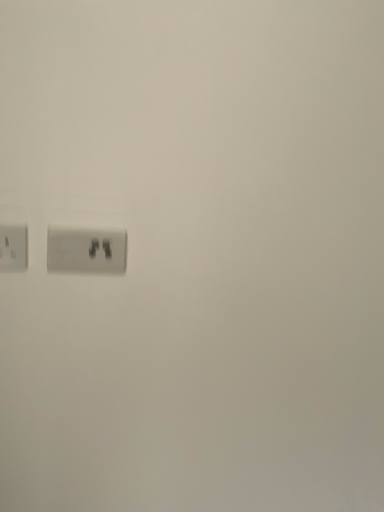
What do you see at coordinates (86, 251) in the screenshot? The image size is (384, 512). I see `white plastic power plugs and sockets at center, marked as the first power plugs and sockets in a right-to-left arrangement` at bounding box center [86, 251].

In the scene shown: How much space does white plastic power plugs and sockets at center, the second power plugs and sockets viewed from the left, occupy vertically?

It is 3.53 inches.

Locate an element on the screen. The width and height of the screenshot is (384, 512). white plastic power plugs and sockets at center, the second power plugs and sockets viewed from the left is located at coordinates (86, 251).

I want to click on matte white power plug at left, which is the first power plugs and sockets from left to right, so click(x=13, y=248).

This screenshot has width=384, height=512. What do you see at coordinates (13, 248) in the screenshot?
I see `matte white power plug at left, which is the first power plugs and sockets from left to right` at bounding box center [13, 248].

How much space does matte white power plug at left, which is the first power plugs and sockets from left to right, occupy horizontally?

The width of matte white power plug at left, which is the first power plugs and sockets from left to right, is 1.77 centimeters.

The image size is (384, 512). In order to click on white plastic power plugs and sockets at center, the second power plugs and sockets viewed from the left in this screenshot , I will do `click(86, 251)`.

Is white plastic power plugs and sockets at center, the second power plugs and sockets viewed from the left, at the left side of matte white power plug at left, the 2th power plugs and sockets viewed from the right?

No, white plastic power plugs and sockets at center, the second power plugs and sockets viewed from the left, is not to the left of matte white power plug at left, the 2th power plugs and sockets viewed from the right.

Which object is closer to the camera taking this photo, white plastic power plugs and sockets at center, the second power plugs and sockets viewed from the left, or matte white power plug at left, which is the first power plugs and sockets from left to right?

matte white power plug at left, which is the first power plugs and sockets from left to right, is closer to the camera.

Which is closer to the camera, (x=47, y=234) or (x=25, y=252)?

The point (x=47, y=234) is more forward.

From the image's perspective, does white plastic power plugs and sockets at center, the second power plugs and sockets viewed from the left, appear higher than matte white power plug at left, the 2th power plugs and sockets viewed from the right?

No, from the image's perspective, white plastic power plugs and sockets at center, the second power plugs and sockets viewed from the left, is not over matte white power plug at left, the 2th power plugs and sockets viewed from the right.

From a real-world perspective, which object stands above the other?

matte white power plug at left, the 2th power plugs and sockets viewed from the right.

Is white plastic power plugs and sockets at center, the second power plugs and sockets viewed from the left, wider or thinner than matte white power plug at left, the 2th power plugs and sockets viewed from the right?

In the image, white plastic power plugs and sockets at center, the second power plugs and sockets viewed from the left, appears to be wider than matte white power plug at left, the 2th power plugs and sockets viewed from the right.

In terms of height, does white plastic power plugs and sockets at center, marked as the first power plugs and sockets in a right-to-left arrangement, look taller or shorter compared to matte white power plug at left, the 2th power plugs and sockets viewed from the right?

In the image, white plastic power plugs and sockets at center, marked as the first power plugs and sockets in a right-to-left arrangement, appears to be taller than matte white power plug at left, the 2th power plugs and sockets viewed from the right.

Considering the sizes of objects white plastic power plugs and sockets at center, the second power plugs and sockets viewed from the left, and matte white power plug at left, the 2th power plugs and sockets viewed from the right, in the image provided, who is bigger, white plastic power plugs and sockets at center, the second power plugs and sockets viewed from the left, or matte white power plug at left, the 2th power plugs and sockets viewed from the right,?

white plastic power plugs and sockets at center, the second power plugs and sockets viewed from the left, is bigger.

Is white plastic power plugs and sockets at center, marked as the first power plugs and sockets in a right-to-left arrangement, inside or outside of matte white power plug at left, the 2th power plugs and sockets viewed from the right?

white plastic power plugs and sockets at center, marked as the first power plugs and sockets in a right-to-left arrangement, cannot be found inside matte white power plug at left, the 2th power plugs and sockets viewed from the right.

Is white plastic power plugs and sockets at center, the second power plugs and sockets viewed from the left, far away from matte white power plug at left, which is the first power plugs and sockets from left to right?

That's not correct — white plastic power plugs and sockets at center, the second power plugs and sockets viewed from the left, is a little close to matte white power plug at left, which is the first power plugs and sockets from left to right.

Is white plastic power plugs and sockets at center, the second power plugs and sockets viewed from the left, oriented towards matte white power plug at left, the 2th power plugs and sockets viewed from the right?

No, white plastic power plugs and sockets at center, the second power plugs and sockets viewed from the left, is not aimed at matte white power plug at left, the 2th power plugs and sockets viewed from the right.

What's the angular difference between white plastic power plugs and sockets at center, the second power plugs and sockets viewed from the left, and matte white power plug at left, the 2th power plugs and sockets viewed from the right,'s facing directions?

The angle between the facing direction of white plastic power plugs and sockets at center, the second power plugs and sockets viewed from the left, and the facing direction of matte white power plug at left, the 2th power plugs and sockets viewed from the right, is 0.0088 degrees.

Identify the location of power plugs and sockets on the right of matte white power plug at left, which is the first power plugs and sockets from left to right. This screenshot has width=384, height=512. (86, 251).

Which is more to the left, matte white power plug at left, which is the first power plugs and sockets from left to right, or white plastic power plugs and sockets at center, the second power plugs and sockets viewed from the left?

From the viewer's perspective, matte white power plug at left, which is the first power plugs and sockets from left to right, appears more on the left side.

Is matte white power plug at left, which is the first power plugs and sockets from left to right, positioned in front of white plastic power plugs and sockets at center, the second power plugs and sockets viewed from the left?

Yes, matte white power plug at left, which is the first power plugs and sockets from left to right, is closer to the camera.

Which point is more forward, (x=24, y=257) or (x=74, y=236)?

The point (x=24, y=257) is in front.

From the image's perspective, who appears lower, matte white power plug at left, which is the first power plugs and sockets from left to right, or white plastic power plugs and sockets at center, the second power plugs and sockets viewed from the left?

From the image's view, white plastic power plugs and sockets at center, the second power plugs and sockets viewed from the left, is below.

Based on the photo, from a real-world perspective, between matte white power plug at left, which is the first power plugs and sockets from left to right, and white plastic power plugs and sockets at center, marked as the first power plugs and sockets in a right-to-left arrangement, who is vertically higher?

matte white power plug at left, which is the first power plugs and sockets from left to right, is physically above.

Between matte white power plug at left, which is the first power plugs and sockets from left to right, and white plastic power plugs and sockets at center, the second power plugs and sockets viewed from the left, which one has larger width?

Wider between the two is white plastic power plugs and sockets at center, the second power plugs and sockets viewed from the left.

Is matte white power plug at left, which is the first power plugs and sockets from left to right, taller or shorter than white plastic power plugs and sockets at center, marked as the first power plugs and sockets in a right-to-left arrangement?

matte white power plug at left, which is the first power plugs and sockets from left to right, is shorter than white plastic power plugs and sockets at center, marked as the first power plugs and sockets in a right-to-left arrangement.

Is matte white power plug at left, which is the first power plugs and sockets from left to right, smaller than white plastic power plugs and sockets at center, marked as the first power plugs and sockets in a right-to-left arrangement?

Yes, matte white power plug at left, which is the first power plugs and sockets from left to right, is smaller than white plastic power plugs and sockets at center, marked as the first power plugs and sockets in a right-to-left arrangement.

Which is correct: matte white power plug at left, the 2th power plugs and sockets viewed from the right, is inside white plastic power plugs and sockets at center, the second power plugs and sockets viewed from the left, or outside of it?

matte white power plug at left, the 2th power plugs and sockets viewed from the right, is not enclosed by white plastic power plugs and sockets at center, the second power plugs and sockets viewed from the left.

Would you consider matte white power plug at left, which is the first power plugs and sockets from left to right, to be distant from white plastic power plugs and sockets at center, marked as the first power plugs and sockets in a right-to-left arrangement?

No, matte white power plug at left, which is the first power plugs and sockets from left to right, is in close proximity to white plastic power plugs and sockets at center, marked as the first power plugs and sockets in a right-to-left arrangement.

Is matte white power plug at left, which is the first power plugs and sockets from left to right, oriented towards white plastic power plugs and sockets at center, marked as the first power plugs and sockets in a right-to-left arrangement?

No, matte white power plug at left, which is the first power plugs and sockets from left to right, is not oriented towards white plastic power plugs and sockets at center, marked as the first power plugs and sockets in a right-to-left arrangement.

From the picture: How distant is matte white power plug at left, the 2th power plugs and sockets viewed from the right, from white plastic power plugs and sockets at center, marked as the first power plugs and sockets in a right-to-left arrangement?

The distance of matte white power plug at left, the 2th power plugs and sockets viewed from the right, from white plastic power plugs and sockets at center, marked as the first power plugs and sockets in a right-to-left arrangement, is 4.10 inches.

Identify the location of power plugs and sockets behind the matte white power plug at left, which is the first power plugs and sockets from left to right. (86, 251).

Locate an element on the screen. This screenshot has height=512, width=384. power plugs and sockets that appears above the white plastic power plugs and sockets at center, marked as the first power plugs and sockets in a right-to-left arrangement (from the image's perspective) is located at coordinates (13, 248).

Find the location of a particular element. power plugs and sockets on the right of matte white power plug at left, the 2th power plugs and sockets viewed from the right is located at coordinates (86, 251).